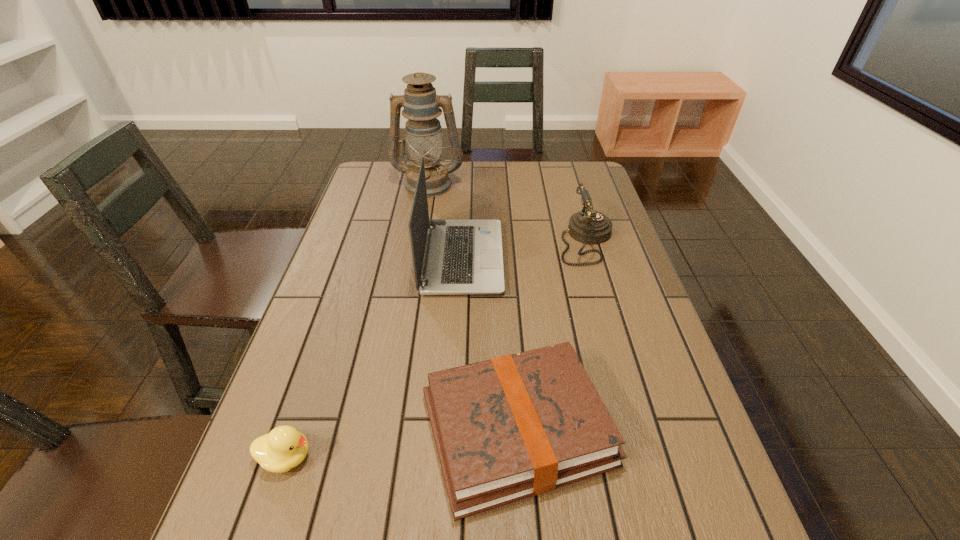
The image size is (960, 540). Find the location of `vacant space located on the beak of the duckling`. vacant space located on the beak of the duckling is located at coordinates 527,457.

The height and width of the screenshot is (540, 960). I want to click on object that is at the far edge, so click(x=423, y=135).

Locate an element on the screen. Image resolution: width=960 pixels, height=540 pixels. oil lamp that is at the left edge is located at coordinates (423, 135).

Locate an element on the screen. The width and height of the screenshot is (960, 540). duckling that is positioned at the left edge is located at coordinates (284, 448).

Identify the location of object at the right edge. (588, 226).

Locate an element on the screen. object located in the far left corner section of the desktop is located at coordinates [x=423, y=135].

This screenshot has width=960, height=540. Identify the location of vacant space at the far edge of the desktop. (x=473, y=180).

Identify the location of free space at the left edge of the desktop. The image size is (960, 540). (339, 427).

Image resolution: width=960 pixels, height=540 pixels. Find the location of `vacant area at the right edge`. vacant area at the right edge is located at coordinates (695, 528).

At what (x,y) coordinates should I click in order to perform the action: click on vacant space at the far left corner of the desktop. Please return your answer as a coordinate pair (x, y). The width and height of the screenshot is (960, 540). Looking at the image, I should click on (397, 185).